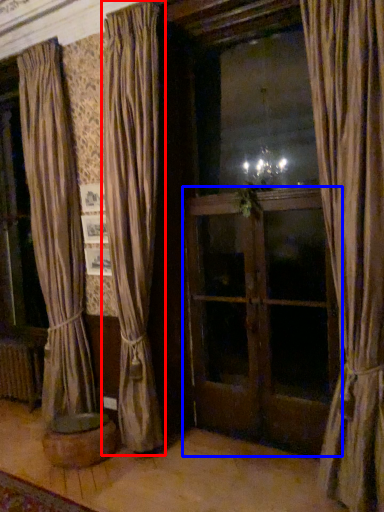
Question: Which point is further to the camera, curtain (highlighted by a red box) or screen door (highlighted by a blue box)?

Choices:
 (A) curtain
 (B) screen door

Answer: (B)